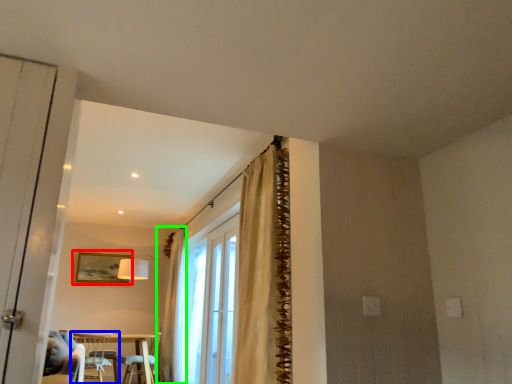
Question: Which is nearer to the picture frame (highlighted by a red box)? chair (highlighted by a blue box) or curtain (highlighted by a green box).

Choices:
 (A) chair
 (B) curtain

Answer: (A)